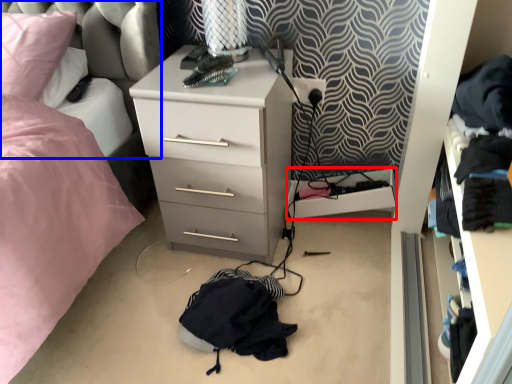
Question: Which of the following is the farthest to the observer, shelf (highlighted by a red box) or swivel chair (highlighted by a blue box)?

Choices:
 (A) shelf
 (B) swivel chair

Answer: (A)